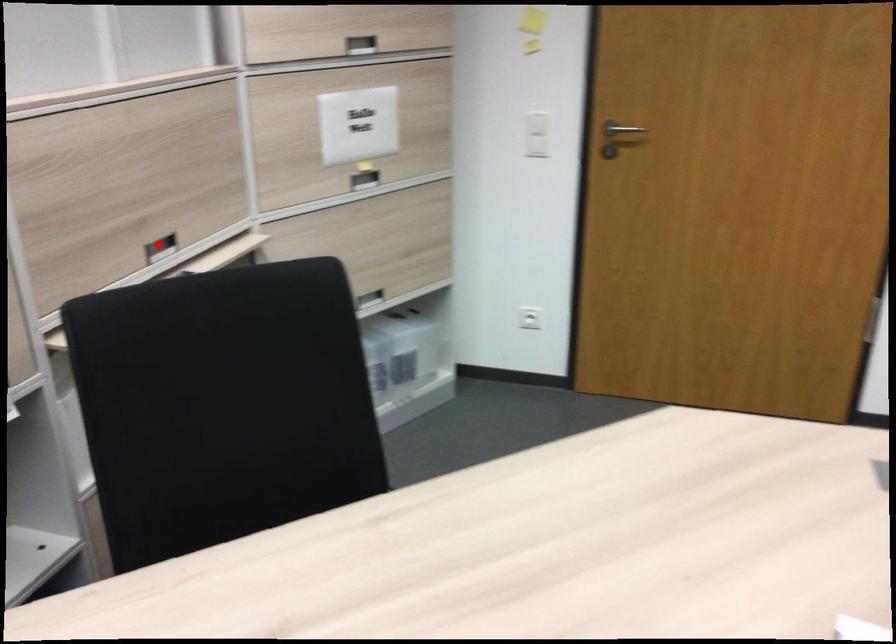
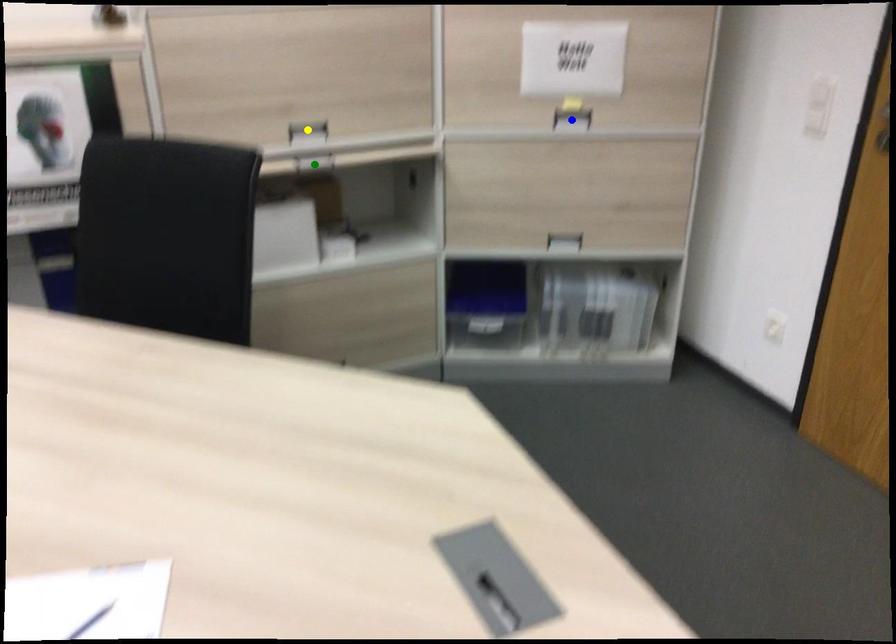
Question: I am providing you with two images of the same scene from different viewpoints. A red point is marked on the first image. You are given multiple points on the second image. Which point in image 2 is actually the same real-world point as the red point in image 1?

Choices:
 (A) blue point
 (B) yellow point
 (C) green point

Answer: (B)